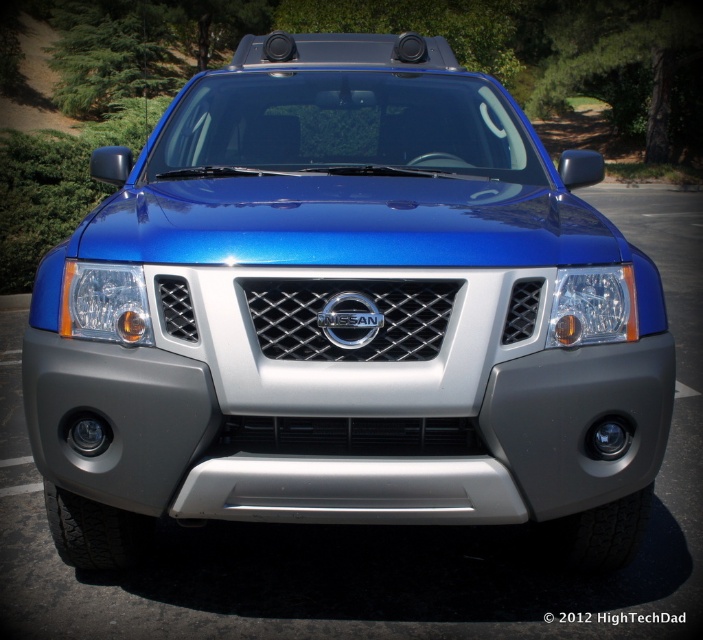
Is translucent plastic headlight at left thinner than clear plastic headlight at center-right?

Incorrect, translucent plastic headlight at left's width is not less than clear plastic headlight at center-right's.

Does translucent plastic headlight at left appear over clear plastic headlight at center-right?

Yes, translucent plastic headlight at left is above clear plastic headlight at center-right.

The image size is (703, 640). Describe the element at coordinates (103, 301) in the screenshot. I see `translucent plastic headlight at left` at that location.

You are a GUI agent. You are given a task and a screenshot of the screen. Output one action in this format:
    pyautogui.click(x=<x>, y=<y>)
    Task: Click on the translucent plastic headlight at left
    This screenshot has height=640, width=703.
    Given the screenshot: What is the action you would take?
    pyautogui.click(x=103, y=301)